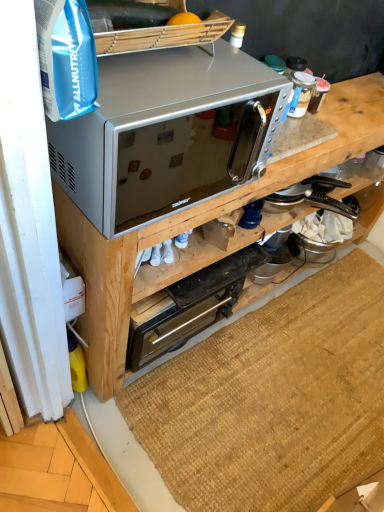
Question: Which direction should I rotate to look at metallic stainless steel toaster oven at center?

Choices:
 (A) right
 (B) left

Answer: (B)

Question: Can you confirm if metallic stainless steel toaster oven at center is bigger than silver metallic microwave at upper center?

Choices:
 (A) no
 (B) yes

Answer: (A)

Question: Is metallic stainless steel toaster oven at center oriented towards silver metallic microwave at upper center?

Choices:
 (A) no
 (B) yes

Answer: (B)

Question: Is silver metallic microwave at upper center a part of metallic stainless steel toaster oven at center?

Choices:
 (A) yes
 (B) no

Answer: (B)

Question: Is metallic stainless steel toaster oven at center behind silver metallic microwave at upper center?

Choices:
 (A) yes
 (B) no

Answer: (A)

Question: Is silver metallic microwave at upper center at the back of metallic stainless steel toaster oven at center?

Choices:
 (A) yes
 (B) no

Answer: (A)

Question: Does metallic stainless steel toaster oven at center have a smaller size compared to silver metallic microwave at upper center?

Choices:
 (A) no
 (B) yes

Answer: (B)

Question: Considering the relative sizes of metallic stainless steel toaster oven at center and satin silver microwave at upper center in the image provided, is metallic stainless steel toaster oven at center wider than satin silver microwave at upper center?

Choices:
 (A) yes
 (B) no

Answer: (B)

Question: Could satin silver microwave at upper center be considered to be inside metallic stainless steel toaster oven at center?

Choices:
 (A) no
 (B) yes

Answer: (A)

Question: Does metallic stainless steel toaster oven at center touch satin silver microwave at upper center?

Choices:
 (A) no
 (B) yes

Answer: (A)

Question: Are metallic stainless steel toaster oven at center and satin silver microwave at upper center far apart?

Choices:
 (A) yes
 (B) no

Answer: (B)

Question: Is metallic stainless steel toaster oven at center outside satin silver microwave at upper center?

Choices:
 (A) no
 (B) yes

Answer: (B)

Question: Does metallic stainless steel toaster oven at center appear on the left side of satin silver microwave at upper center?

Choices:
 (A) no
 (B) yes

Answer: (B)

Question: From a real-world perspective, does satin silver microwave at upper center stand above brown woven mat at lower center?

Choices:
 (A) no
 (B) yes

Answer: (B)